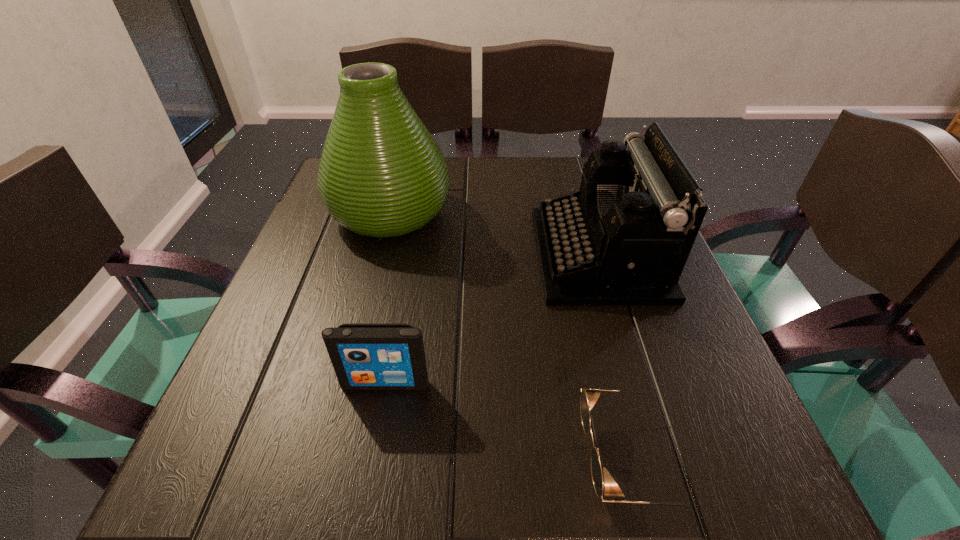
You are a GUI agent. You are given a task and a screenshot of the screen. Output one action in this format:
    pyautogui.click(x=<x>, y=<y>)
    Task: Click on the vacant space that satisfies the following two spatial constraints: 1. on the typing side of the typewriter; 2. on the front screen of the third farthest object
    
    Given the screenshot: What is the action you would take?
    pyautogui.click(x=637, y=383)

Locate an element on the screen. The height and width of the screenshot is (540, 960). free point that satisfies the following two spatial constraints: 1. on the typing side of the typewriter; 2. on the front screen of the third farthest object is located at coordinates (637, 383).